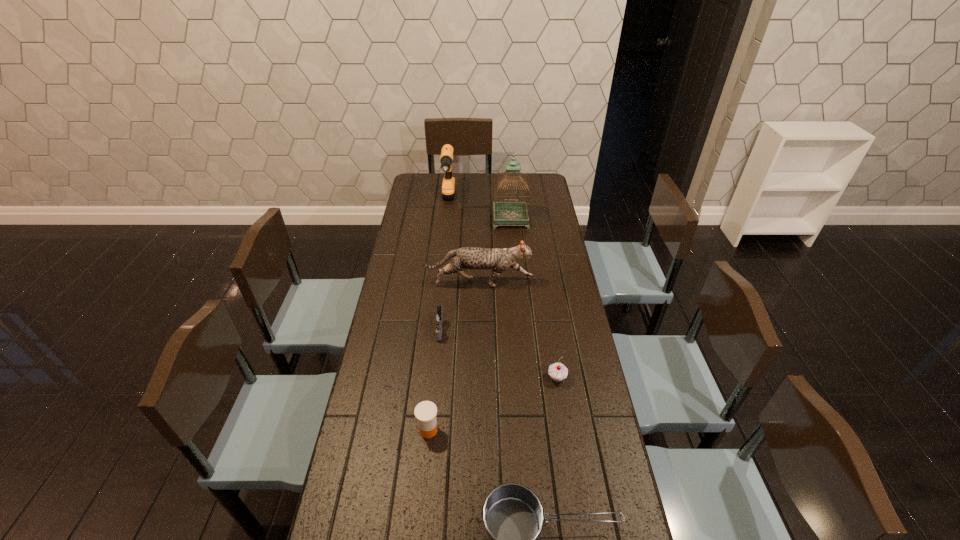
The image size is (960, 540). I want to click on free spot located 0.050m on the left of the igniter, so click(x=418, y=330).

At what (x,y) coordinates should I click in order to perform the action: click on vacant region located 0.390m on the label of the second nearest object. Please return your answer as a coordinate pair (x, y). Looking at the image, I should click on (575, 430).

The image size is (960, 540). What are the coordinates of `free space located on the back of the third nearest object` in the screenshot? It's located at (546, 313).

In order to click on object that is at the far edge in this screenshot , I will do `click(448, 186)`.

I want to click on object that is positioned at the left edge, so click(499, 260).

You are a GUI agent. You are given a task and a screenshot of the screen. Output one action in this format:
    pyautogui.click(x=<x>, y=<y>)
    Task: Click on the birdcage at the right edge
    
    Given the screenshot: What is the action you would take?
    pyautogui.click(x=506, y=213)

Find the location of a particular element. This screenshot has height=540, width=960. cat at the right edge is located at coordinates (499, 260).

Where is `cupcake that is at the right edge`? cupcake that is at the right edge is located at coordinates (557, 371).

I want to click on free space at the far edge of the desktop, so click(474, 193).

Where is `vacant space at the left edge of the desktop`? vacant space at the left edge of the desktop is located at coordinates (403, 212).